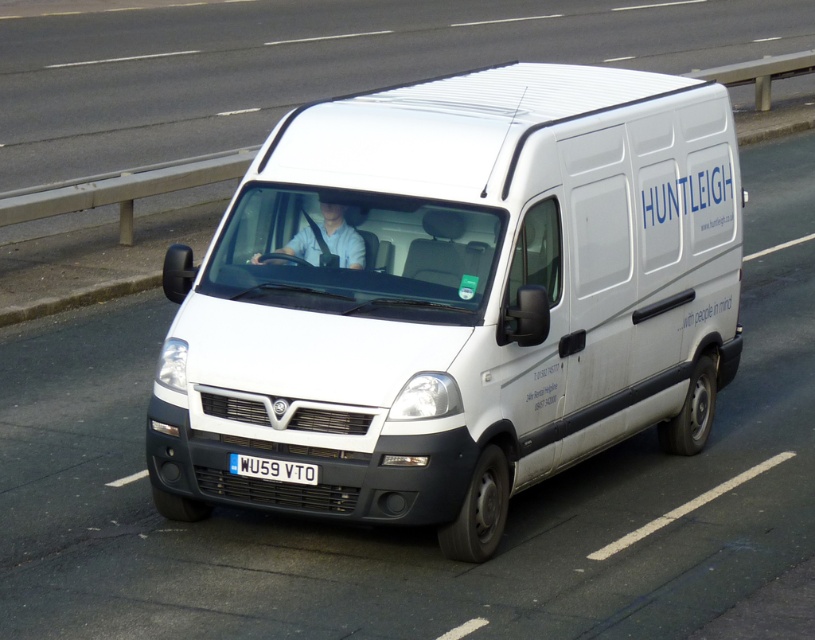
You are standing on the sidewalk and see the white matte van at center approaching you. If the van is moving at 20 mph, how many seconds will it take for the van to reach you?

The white matte van at center is 22.24 feet away from you. At 20 mph, the van travels approximately 29.33 feet per second. Dividing the distance by speed gives 22.24 divided by 29.33 equals approximately 0.76 seconds. So, the van will reach you in about 0.76 seconds.

You are a traffic officer observing a white matte van at center and a white plastic license plate at center. Which object is positioned higher in the image?

The white matte van at center is above the white plastic license plate at center, so the white matte van at center is positioned higher in the image.